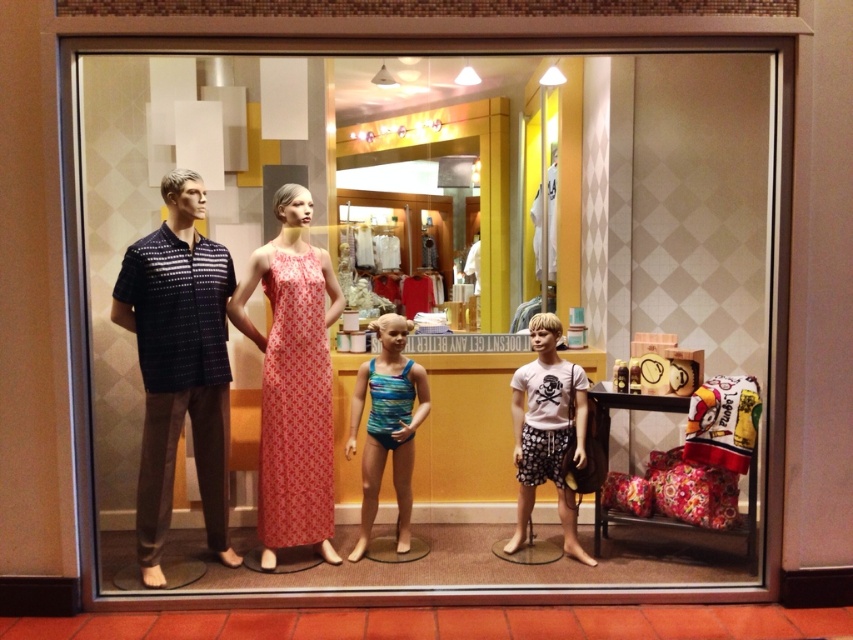
You are standing in front of the store window and want to touch the two points marked on the display. Which point, point (316, 336) or point (399, 468), would require you to reach out less to touch it?

Point (316, 336) is closer to the viewer than point (399, 468), so you would need to reach out less to touch point (316, 336).

Where is the matte pink dress at center located in the image?

The matte pink dress at center is located at point coordinates of 0.597 on the x axis and 0.345 on the y axis.